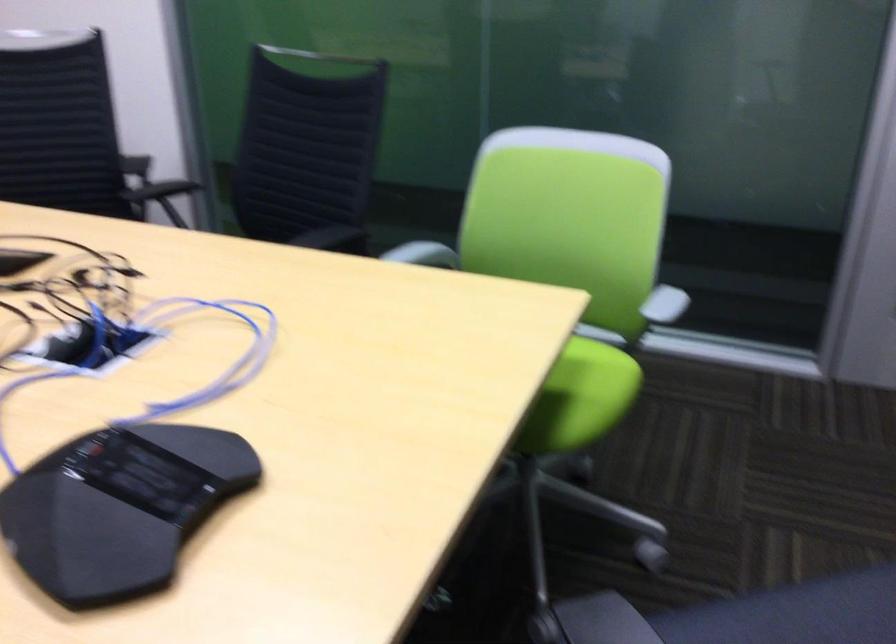
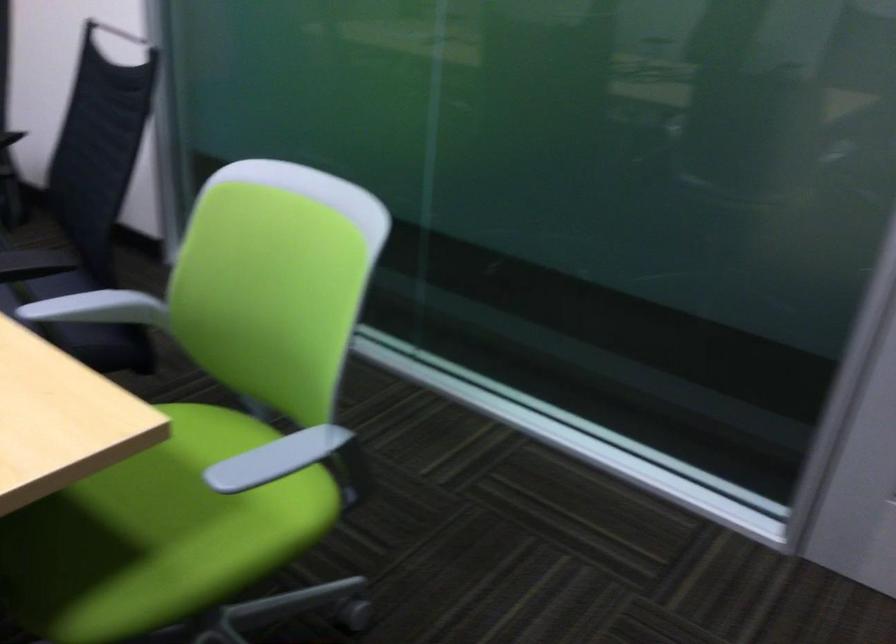
Find the pixel in the second image that matches (x=658, y=301) in the first image.

(276, 458)